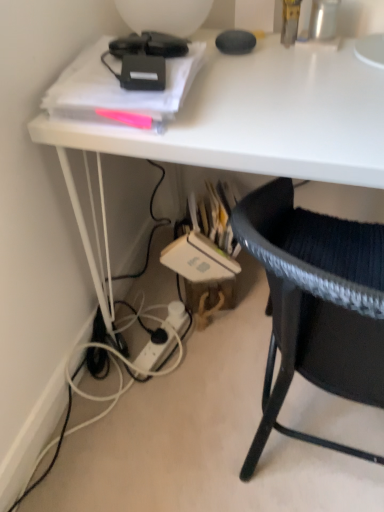
Question: Is point (43, 115) positioned closer to the camera than point (365, 304)?

Choices:
 (A) farther
 (B) closer

Answer: (A)

Question: Considering the positions of white glossy desk at upper center and black woven chair at lower right in the image, is white glossy desk at upper center wider or thinner than black woven chair at lower right?

Choices:
 (A) thin
 (B) wide

Answer: (B)

Question: Which of these objects is positioned farthest from the black woven chair at lower right?

Choices:
 (A) white glossy desk at upper center
 (B) white plastic power outlet at lower center

Answer: (B)

Question: Considering the real-world distances, which object is closest to the white plastic power outlet at lower center?

Choices:
 (A) white glossy desk at upper center
 (B) black woven chair at lower right

Answer: (B)